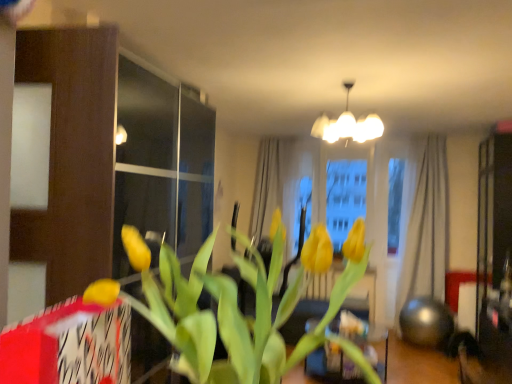
Question: Is beige fabric curtain at right bigger or smaller than yellow matte tulip at center?

Choices:
 (A) big
 (B) small

Answer: (A)

Question: Is beige fabric curtain at right wider or thinner than yellow matte tulip at center?

Choices:
 (A) wide
 (B) thin

Answer: (B)

Question: Considering the real-world distances, which object is closest to the white glossy chandelier at upper center?

Choices:
 (A) beige fabric curtain at right
 (B) yellow matte tulip at center

Answer: (A)

Question: Which of these objects is positioned closest to the yellow matte tulip at center?

Choices:
 (A) beige fabric curtain at right
 (B) white glossy chandelier at upper center

Answer: (B)